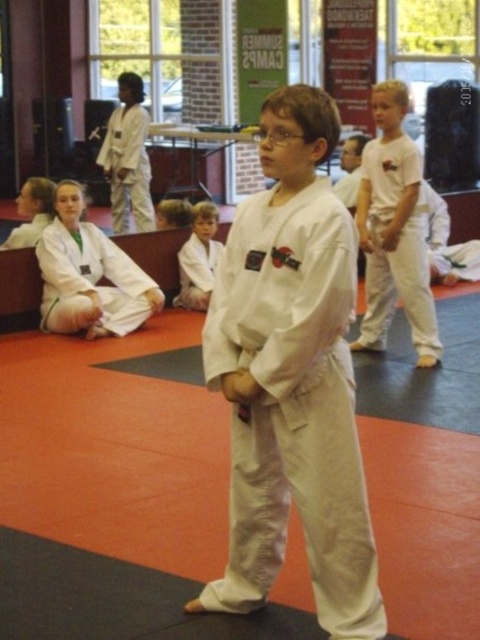
You are a photographer in the dojo and want to take a clear picture of the white cotton karate gi at center without the white cotton karate uniform at center blocking it. Is this possible?

The white cotton karate uniform at center is positioned over the white cotton karate gi at center, so taking a clear picture of the white cotton karate gi at center without obstruction is not possible as it is covered by the uniform.

Where is the white cotton karate uniform at center located in the image?

The white cotton karate uniform at center is located at point (394,230).